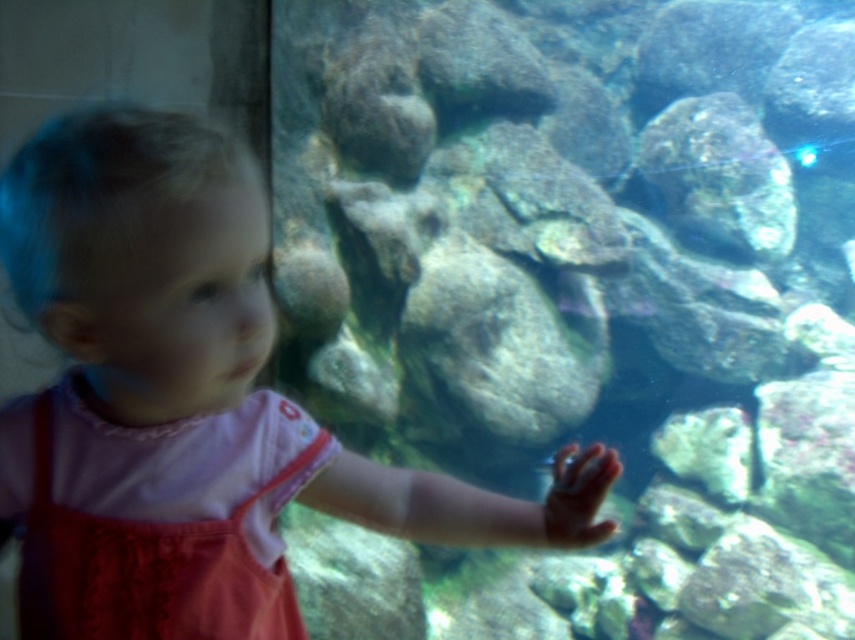
The child in the image is wearing a pink cotton dress at center and has a pink fabric at center. Which of these is positioned higher on the child?

The pink fabric at center is positioned higher than the pink cotton dress at center.

You are a photographer trying to capture the perfect shot of the child in the aquarium scene. You want to focus on the point at coordinates point (x=290, y=440). If your camera has a depth of field that can clearly capture objects within 38 inches from the lens, will the point be in focus?

The distance of point (x=290, y=440) from camera is 37.98 inches, so yes, the point will be in focus since it is within the 38 inches depth of field range.